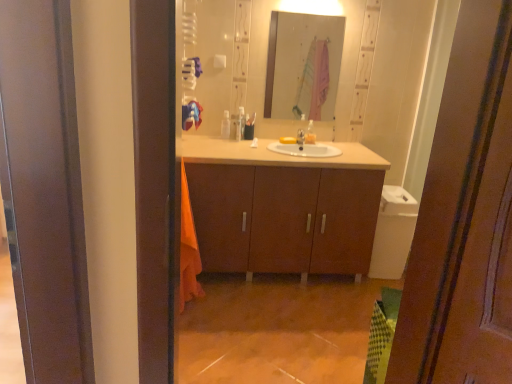
Locate an element on the screen. Image resolution: width=512 pixels, height=384 pixels. vacant space to the right of silver metallic tap at center is located at coordinates (318, 145).